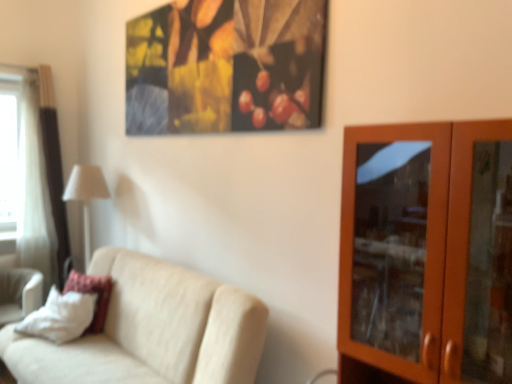
Question: Considering the positions of point (22, 269) and point (72, 168), is point (22, 269) closer or farther from the camera than point (72, 168)?

Choices:
 (A) closer
 (B) farther

Answer: (A)

Question: From the image's perspective, is white fabric swivel chair at lower left located above or below white fabric lampshade at left?

Choices:
 (A) above
 (B) below

Answer: (B)

Question: Which object is the farthest from the beige fabric couch at lower left?

Choices:
 (A) white fabric lampshade at left
 (B) white sheer curtain at left
 (C) white soft pillow at lower left
 (D) white fabric swivel chair at lower left
 (E) brown wooden cabinet at right

Answer: (B)

Question: Which object is positioned farthest from the white fabric lampshade at left?

Choices:
 (A) white soft pillow at lower left
 (B) beige fabric couch at lower left
 (C) brown wooden cabinet at right
 (D) white fabric swivel chair at lower left
 (E) white sheer curtain at left

Answer: (C)